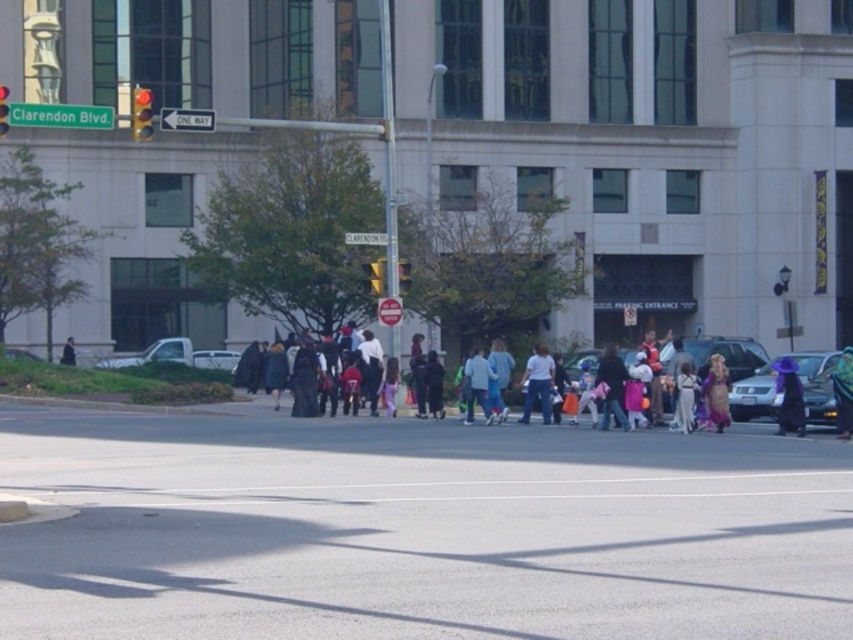
Based on the photo, between yellow matte traffic light at center and yellow plastic traffic light at center, which one has more height?

With more height is yellow plastic traffic light at center.

Is yellow matte traffic light at center bigger than yellow plastic traffic light at center?

No, yellow matte traffic light at center is not bigger than yellow plastic traffic light at center.

Between point (376, 275) and point (399, 276), which one is positioned in front?

Point (376, 275)

Locate an element on the screen. yellow matte traffic light at center is located at coordinates (376, 276).

Who is lower down, metallic silver suv at center or red glass traffic light at upper left?

Positioned lower is metallic silver suv at center.

Does metallic silver suv at center come behind red glass traffic light at upper left?

That is False.

Is point (722, 355) closer to camera compared to point (144, 104)?

No, it is not.

At what (x,y) coordinates should I click in order to perform the action: click on metallic silver suv at center. Please return your answer as a coordinate pair (x, y). This screenshot has height=640, width=853. Looking at the image, I should click on (726, 355).

Is yellow matte traffic light at center closer to camera compared to matte black jacket at center?

Yes, yellow matte traffic light at center is closer to the viewer.

Which is behind, point (376, 259) or point (70, 358)?

The point (70, 358) is behind.

Identify the location of yellow matte traffic light at center. The width and height of the screenshot is (853, 640). (376, 276).